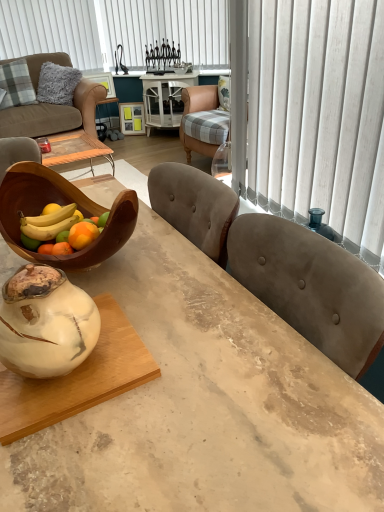
The width and height of the screenshot is (384, 512). What are the coordinates of `empty space that is to the right of white marble vase at center` in the screenshot? It's located at (169, 362).